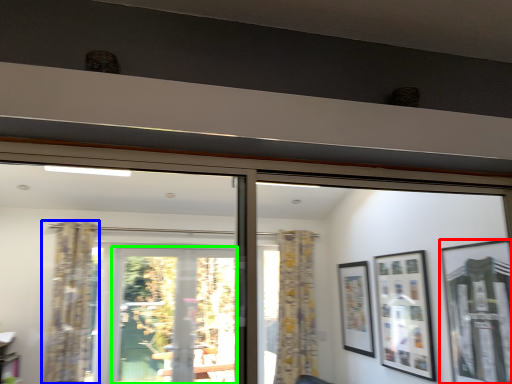
Question: Which object is positioned closest to picture frame (highlighted by a red box)? Select from curtain (highlighted by a blue box) and screen door (highlighted by a green box).

Choices:
 (A) curtain
 (B) screen door

Answer: (B)